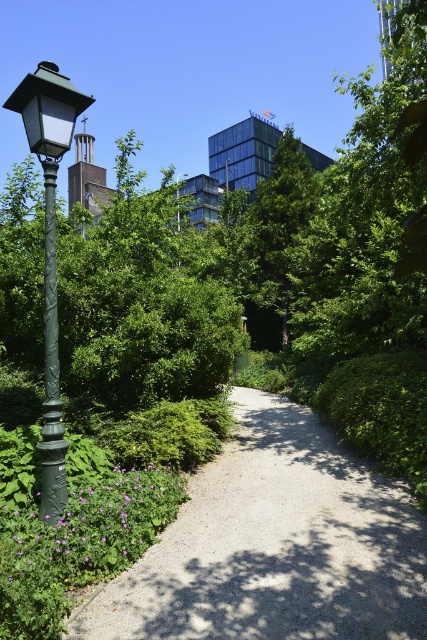
Does green matte lamp post at left have a lesser height compared to green matte street light at upper center?

Yes.

Can you confirm if green matte lamp post at left is thinner than green matte street light at upper center?

Correct, green matte lamp post at left's width is less than green matte street light at upper center's.

At what (x,y) coordinates should I click in order to perform the action: click on green matte lamp post at left. Please return your answer as a coordinate pair (x, y). The width and height of the screenshot is (427, 640). Looking at the image, I should click on (49, 252).

Is gravel path at center thinner than green textured pole at left?

In fact, gravel path at center might be wider than green textured pole at left.

Is point (350, 563) farther from camera compared to point (46, 282)?

No, it is in front of (46, 282).

Image resolution: width=427 pixels, height=640 pixels. I want to click on gravel path at center, so (275, 545).

Where is `gravel path at center`? The width and height of the screenshot is (427, 640). gravel path at center is located at coordinates (275, 545).

Who is higher up, gravel path at center or green matte lamp post at left?

Positioned higher is green matte lamp post at left.

At what (x,y) coordinates should I click in order to perform the action: click on gravel path at center. Please return your answer as a coordinate pair (x, y). Image resolution: width=427 pixels, height=640 pixels. Looking at the image, I should click on (275, 545).

Locate an element on the screen. The width and height of the screenshot is (427, 640). gravel path at center is located at coordinates (275, 545).